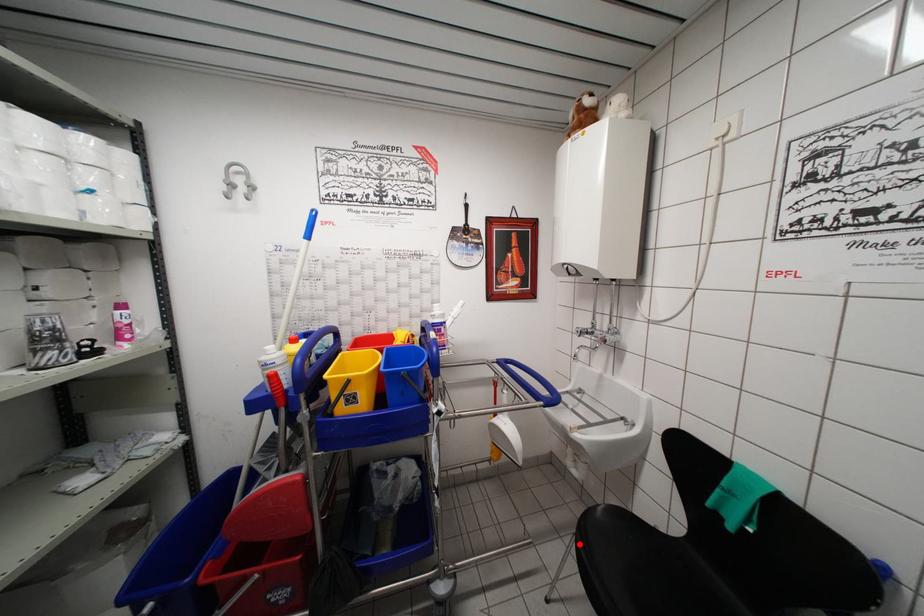
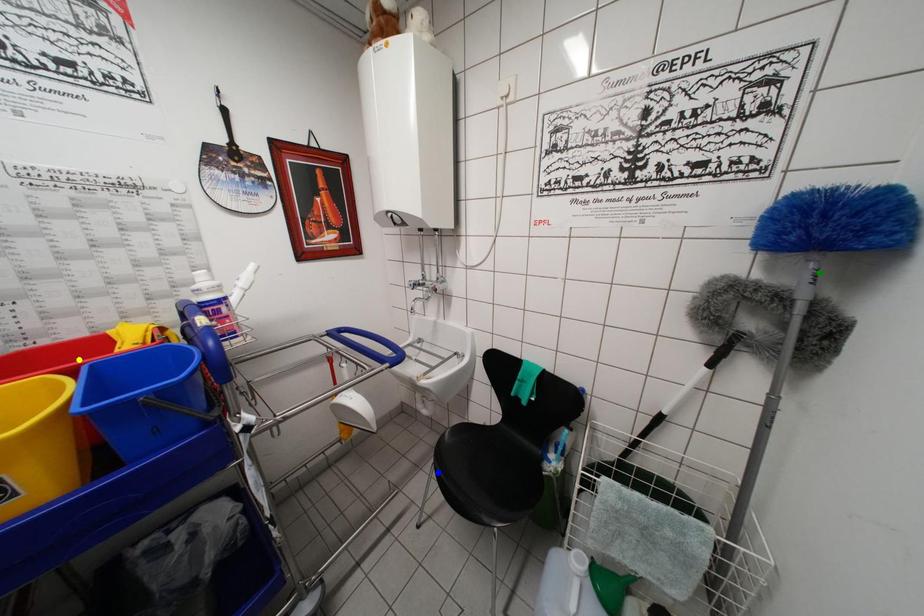
Question: I am providing you with two images of the same scene from different viewpoints. A red point is marked on the first image. You are given multiple points on the second image. Which point in image 2 is actually the same real-world point as the red point in image 1?

Choices:
 (A) blue point
 (B) green point
 (C) yellow point

Answer: (A)